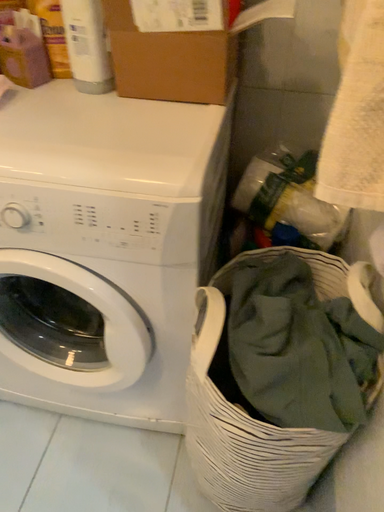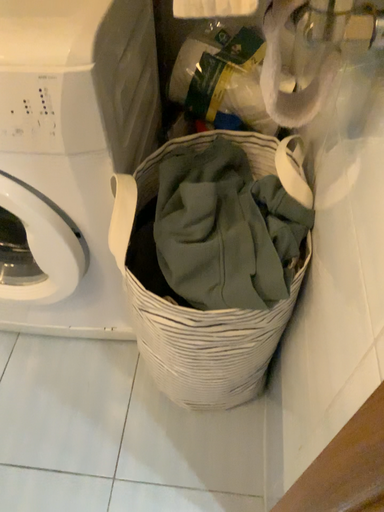
Question: Which way did the camera rotate in the video?

Choices:
 (A) rotated downward
 (B) rotated upward

Answer: (A)